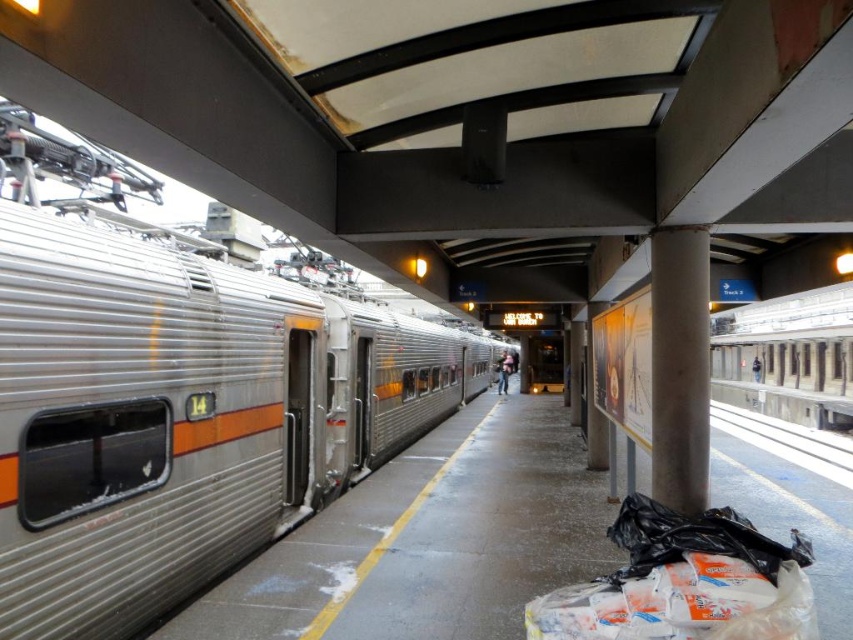
You are standing on the train station platform and want to walk from point (39,564) to point (766,444). Which direction should you face to move towards the correct destination?

You should face towards the lower right direction because point (766,444) is further away from the viewer compared to point (39,564).

You are a maintenance worker standing at the edge of the platform near the yellow safety line. You need to inspect the silver metallic train at left. Given that the yellow safety line is 1.5 meters away from the edge of the platform, can you safely approach the train without crossing the safety line?

The silver metallic train at left is 3.30 meters away from the camera. Since the yellow safety line is only 1.5 meters from the edge, you can approach the train while staying behind the safety line as there is sufficient distance between you and the train.